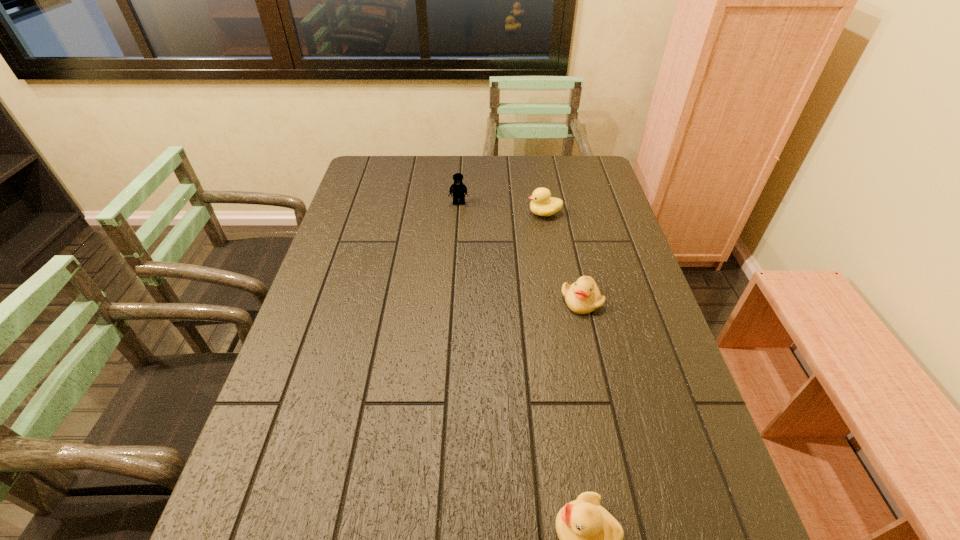
The width and height of the screenshot is (960, 540). I want to click on unoccupied area between the leftmost object and the second farthest duckling, so click(x=520, y=252).

This screenshot has height=540, width=960. In order to click on free area in between the Lego and the farthest duckling in this screenshot , I will do `click(501, 208)`.

You are a GUI agent. You are given a task and a screenshot of the screen. Output one action in this format:
    pyautogui.click(x=<x>, y=<y>)
    Task: Click on the object that is the third nearest to the leftmost object
    The height and width of the screenshot is (540, 960).
    Given the screenshot: What is the action you would take?
    pyautogui.click(x=590, y=539)

Identify the location of the closest object to the farthest duckling. This screenshot has width=960, height=540. (458, 189).

Where is `duckling object that ranks as the second closest to the second nearest duckling`? duckling object that ranks as the second closest to the second nearest duckling is located at coordinates (590, 539).

Identify which duckling is the nearest to the farthest duckling. Please provide its 2D coordinates. Your answer should be formatted as a tuple, i.e. [(x, y)], where the tuple contains the x and y coordinates of a point satisfying the conditions above.

[(582, 297)]